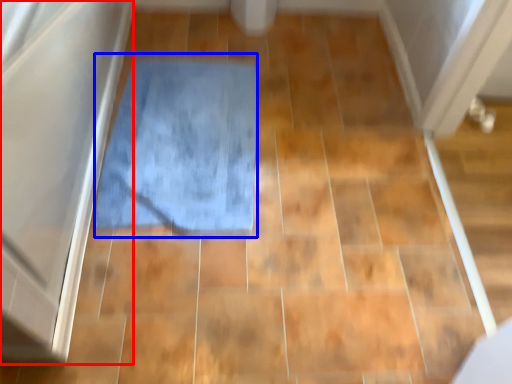
Question: Which of the following is the closest to the observer, screen door (highlighted by a red box) or bath mat (highlighted by a blue box)?

Choices:
 (A) screen door
 (B) bath mat

Answer: (A)